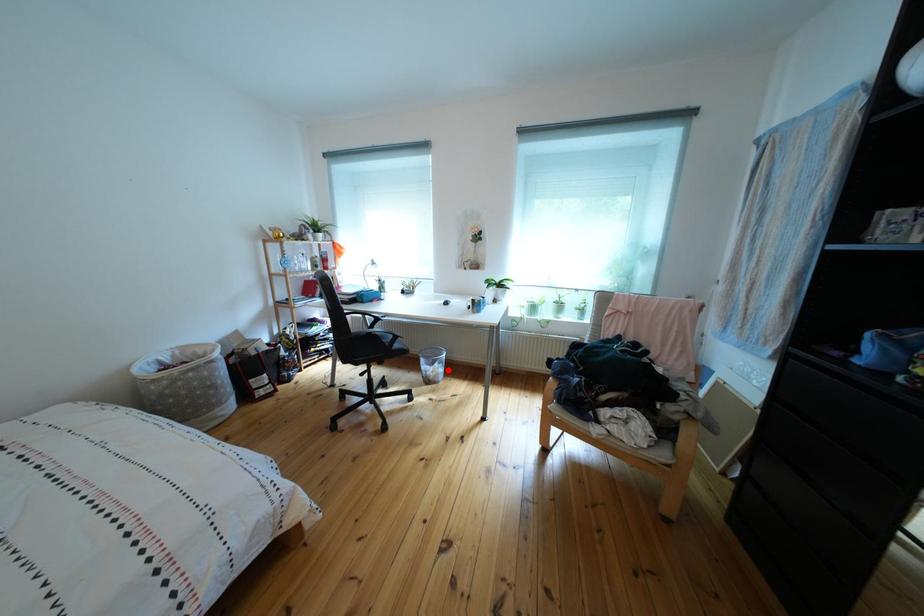
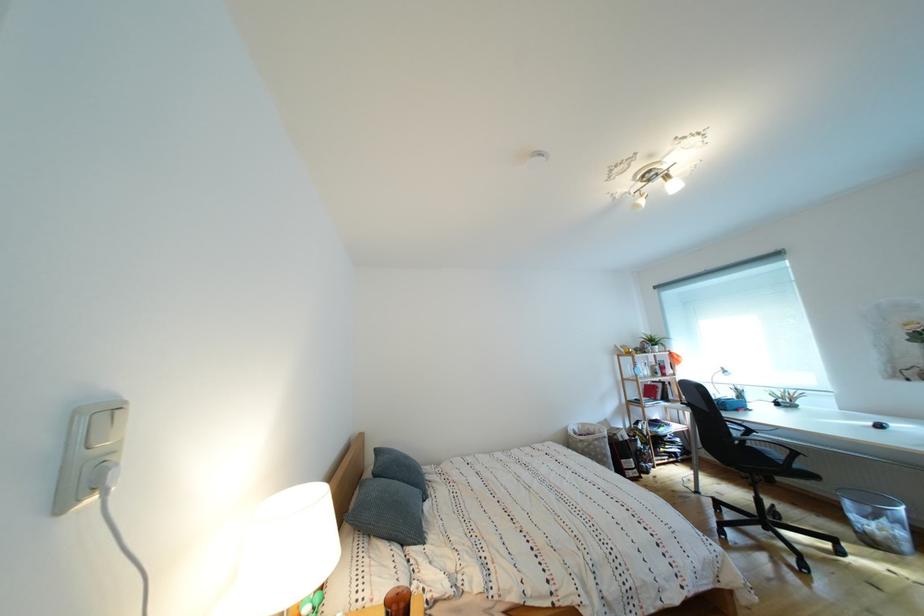
Question: I am providing you with two images of the same scene from different viewpoints. Image1 has a red point marked. In image2, the corresponding 3D location appears at what relative position? Reply with the corresponding letter.

Choices:
 (A) Closer
 (B) Farther

Answer: (A)